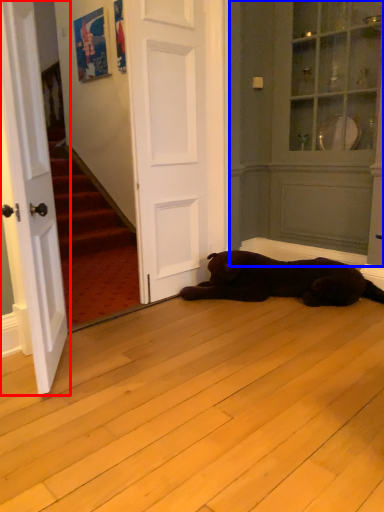
Question: Among these objects, which one is nearest to the camera, door (highlighted by a red box) or armoire (highlighted by a blue box)?

Choices:
 (A) door
 (B) armoire

Answer: (A)